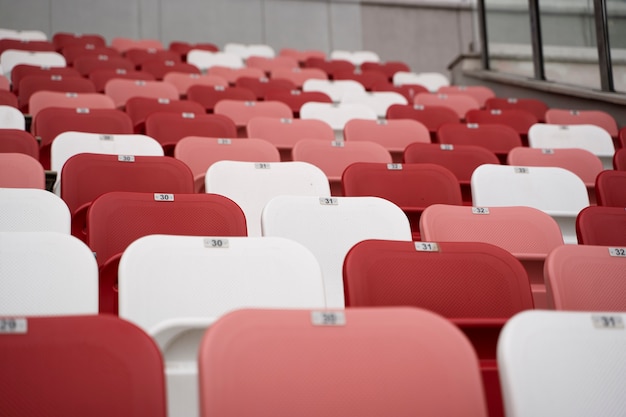
Image resolution: width=626 pixels, height=417 pixels. I want to click on seats in row 33, so click(x=602, y=217), click(x=535, y=193), click(x=449, y=158), click(x=399, y=129), click(x=331, y=111), click(x=297, y=97), click(x=268, y=85), click(x=244, y=70), click(x=223, y=59), click(x=203, y=45).